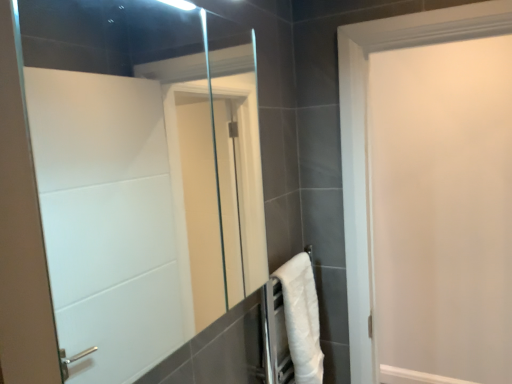
Question: In the image, is white matte door at upper right positioned in front of or behind clear glass mirror at center?

Choices:
 (A) behind
 (B) front

Answer: (A)

Question: Based on their positions, is white matte door at upper right located to the left or right of clear glass mirror at center?

Choices:
 (A) left
 (B) right

Answer: (B)

Question: Estimate the real-world distances between objects in this image. Which object is farther from the white soft towel at lower right?

Choices:
 (A) clear glass mirror at center
 (B) white matte door at upper right

Answer: (B)

Question: Based on their relative distances, which object is farther from the white matte door at upper right?

Choices:
 (A) clear glass mirror at center
 (B) white soft towel at lower right

Answer: (A)